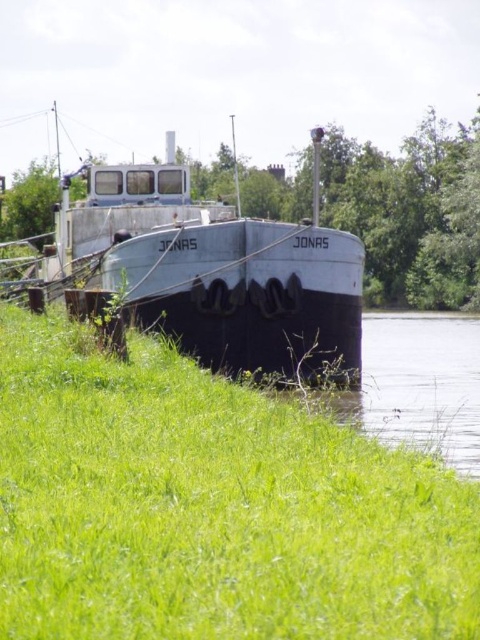
You are standing on the riverbank and notice the green grassy at lower left and the rusty metal barge at center. Which object is taller when viewed from your position?

The rusty metal barge at center is taller than the green grassy at lower left.

You are standing on the riverbank and see the green grassy at lower left and the rusty metal barge at center. Which object is located to the right side from your perspective?

The green grassy at lower left is to the right of the rusty metal barge at center, so from your perspective, the green grassy at lower left is on the right side.